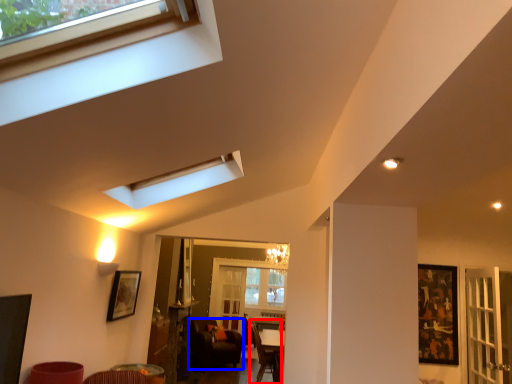
Question: Which of the following is the farthest to the observer, armchair (highlighted by a red box) or chair (highlighted by a blue box)?

Choices:
 (A) armchair
 (B) chair

Answer: (B)